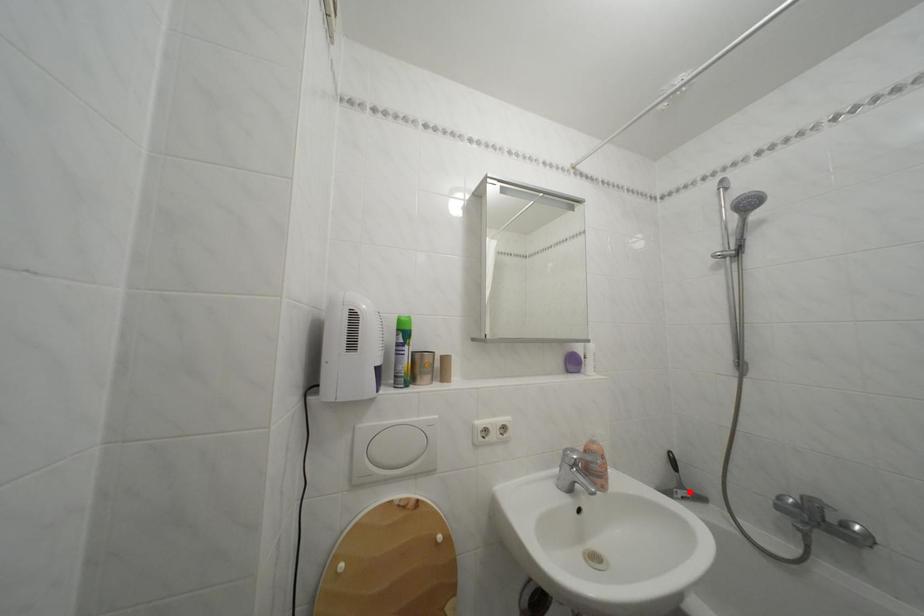
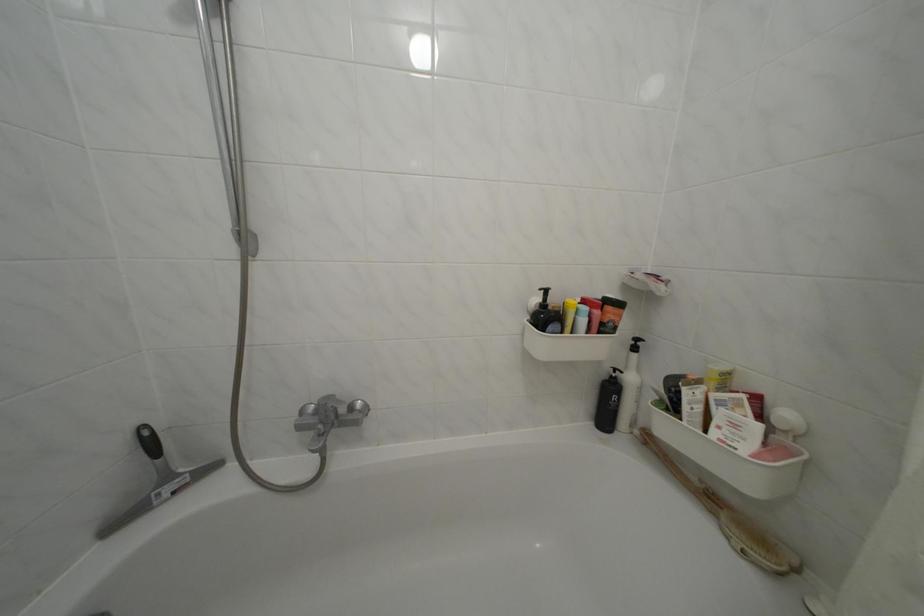
Find the pixel in the second image that matches the highlighted location in the first image.

(176, 484)